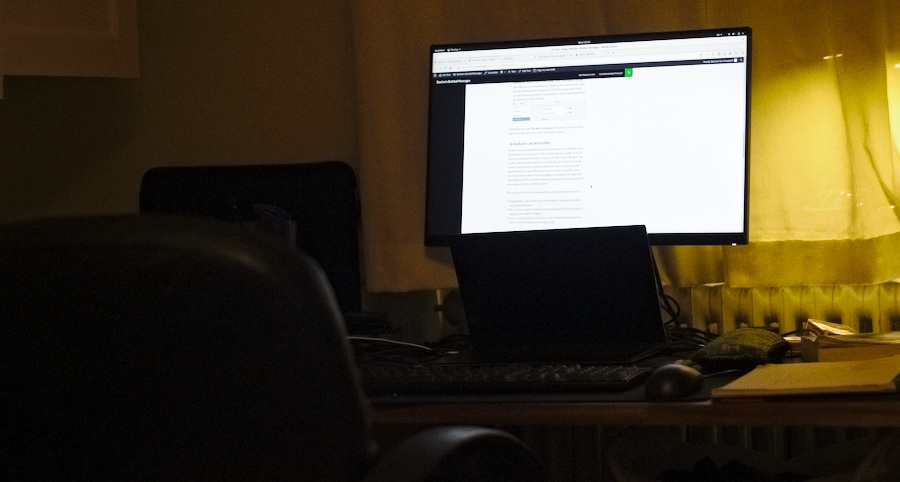
Locate an element on the screen. This screenshot has width=900, height=482. keyboard is located at coordinates (490, 372).